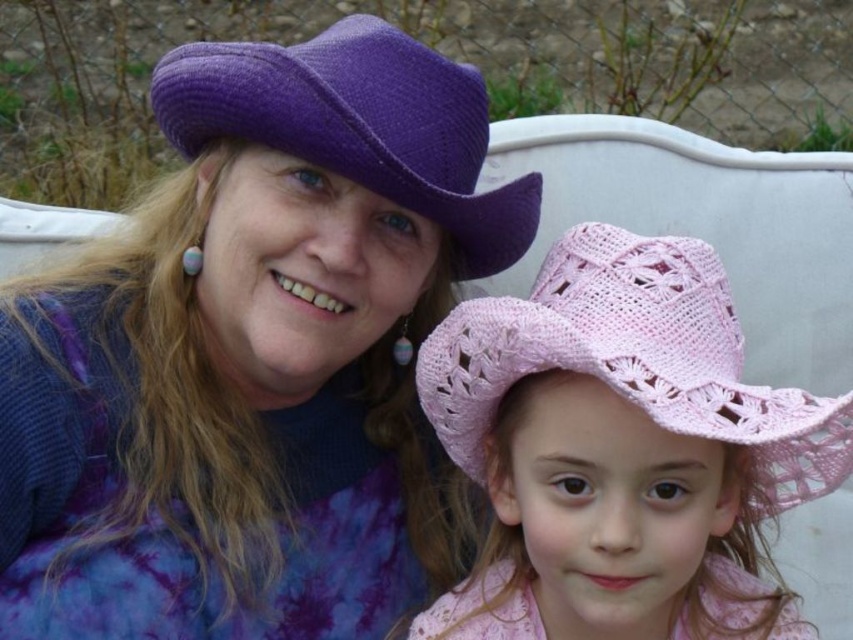
Image resolution: width=853 pixels, height=640 pixels. What do you see at coordinates (254, 356) in the screenshot?
I see `purple knitted hat at upper left` at bounding box center [254, 356].

Does purple knitted hat at upper left come in front of purple woven cowboy hat at upper left?

No.

This screenshot has height=640, width=853. I want to click on purple knitted hat at upper left, so click(254, 356).

Between purple knitted hat at upper left and pink crocheted cowboy hat at right, which one has more height?

With more height is purple knitted hat at upper left.

The height and width of the screenshot is (640, 853). I want to click on purple knitted hat at upper left, so tap(254, 356).

Locate an element on the screen. purple knitted hat at upper left is located at coordinates (254, 356).

Who is taller, pink crocheted cowboy hat at right or purple woven cowboy hat at upper left?

With more height is pink crocheted cowboy hat at right.

Who is positioned more to the right, pink crocheted cowboy hat at right or purple woven cowboy hat at upper left?

Positioned to the right is pink crocheted cowboy hat at right.

The image size is (853, 640). I want to click on pink crocheted cowboy hat at right, so click(x=633, y=358).